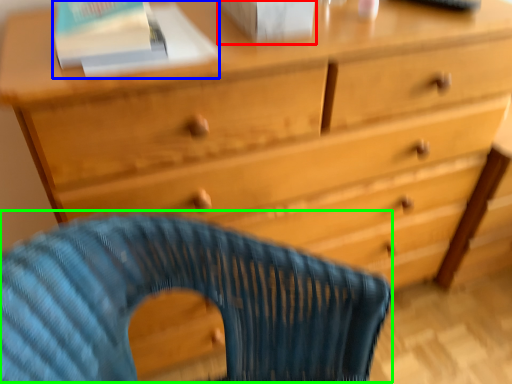
Question: Based on their relative distances, which object is nearer to paperback book (highlighted by a red box)? Choose from paperback book (highlighted by a blue box) and rocking chair (highlighted by a green box).

Choices:
 (A) paperback book
 (B) rocking chair

Answer: (A)